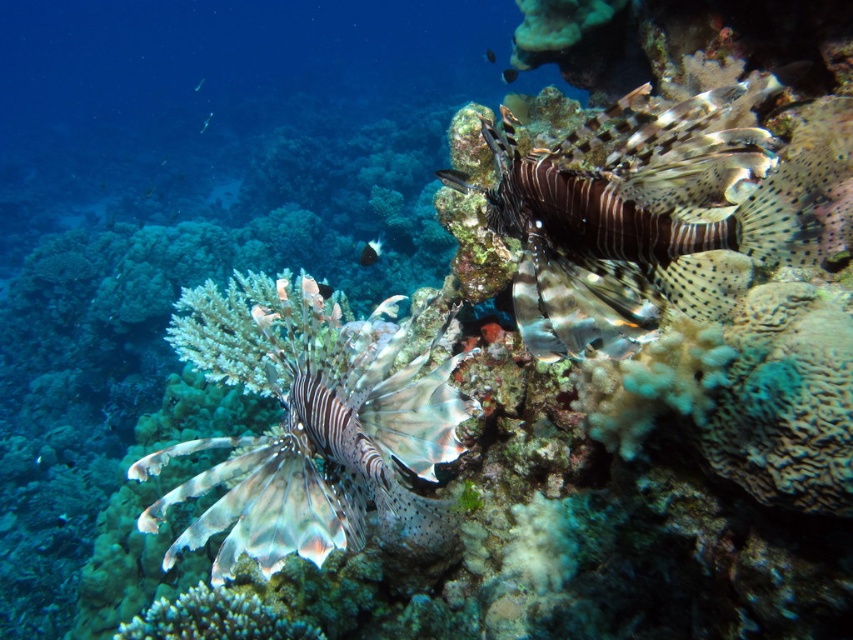
Which is in front, point (483, 189) or point (506, 67)?

Point (483, 189)

Does shiny silver fish at center appear on the left side of translucent blue fish at upper center?

Indeed, shiny silver fish at center is positioned on the left side of translucent blue fish at upper center.

Is point (438, 172) positioned in front of point (503, 68)?

Yes, it is.

Where is `shiny silver fish at center`? This screenshot has height=640, width=853. shiny silver fish at center is located at coordinates (457, 180).

Which is in front, point (482, 188) or point (196, 88)?

Point (482, 188)

Is shiny silver fish at center bigger than translucent white fish at upper center?

No, shiny silver fish at center is not bigger than translucent white fish at upper center.

Who is more forward, (461, 180) or (202, 81)?

Point (461, 180)

At what (x,y) coordinates should I click in order to perform the action: click on shiny silver fish at center. Please return your answer as a coordinate pair (x, y). Looking at the image, I should click on (457, 180).

Can you confirm if translucent iridescent lionfish at center is taller than shiny silver fish at center?

Yes.

Who is lower down, translucent iridescent lionfish at center or shiny silver fish at center?

Positioned lower is translucent iridescent lionfish at center.

Between point (300, 328) and point (453, 172), which one is positioned behind?

Point (300, 328)

This screenshot has height=640, width=853. In order to click on translucent iridescent lionfish at center in this screenshot , I will do (322, 440).